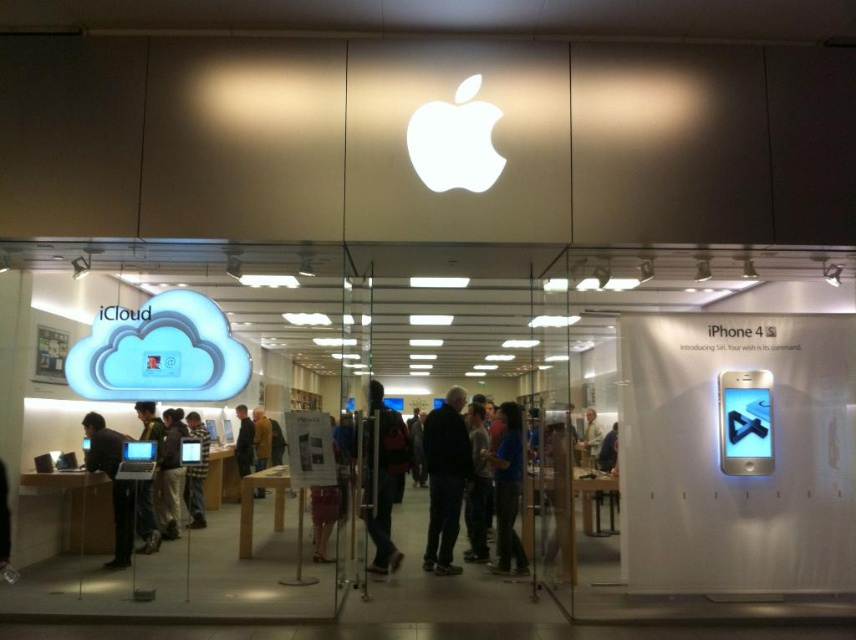
Question: Is dark gray fabric jacket at center positioned before matte black laptop at left?

Choices:
 (A) no
 (B) yes

Answer: (A)

Question: Which point is farther to the camera?

Choices:
 (A) (384, 560)
 (B) (260, 433)
 (C) (192, 428)

Answer: (B)

Question: Which object is positioned closest to the dark brown leather jacket at center?

Choices:
 (A) dark gray fabric jacket at center
 (B) brown leather jacket at center
 (C) matte black laptop at left

Answer: (C)

Question: Does dark gray fabric jacket at center lie in front of dark brown leather jacket at center?

Choices:
 (A) yes
 (B) no

Answer: (B)

Question: Can you confirm if black backpack at center is smaller than brown leather jacket at center?

Choices:
 (A) yes
 (B) no

Answer: (B)

Question: Which point is closer to the camera?

Choices:
 (A) (263, 413)
 (B) (175, 470)
 (C) (99, 435)
 (D) (394, 410)

Answer: (C)